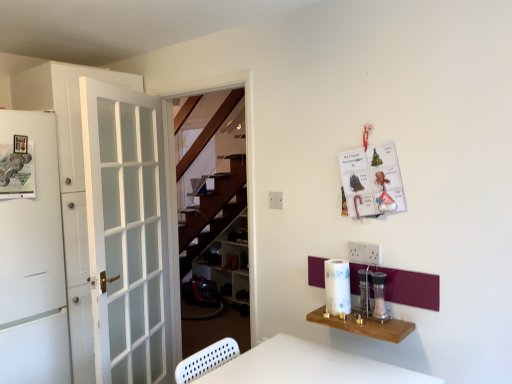
Measure the distance between white matte refrigerator at left, placed as the 1th door when sorted from front to back, and camera.

white matte refrigerator at left, placed as the 1th door when sorted from front to back, and camera are 2.12 meters apart from each other.

Consider the image. What is the approximate height of white matte refrigerator at left, the 2th door from the back?

It is 5.79 feet.

The width and height of the screenshot is (512, 384). What do you see at coordinates (379, 296) in the screenshot?
I see `clear glass salt and pepper shakers at right, the second appliance in the left-to-right sequence` at bounding box center [379, 296].

Measure the distance between metallic silver salt and pepper shakers at center right, which ranks as the 1th appliance in left-to-right order, and camera.

metallic silver salt and pepper shakers at center right, which ranks as the 1th appliance in left-to-right order, and camera are 5.98 feet apart from each other.

The image size is (512, 384). Identify the location of metallic silver salt and pepper shakers at center right, which appears as the 2th appliance when viewed from the right. (365, 291).

Locate an element on the screen. The width and height of the screenshot is (512, 384). white glass door at left, the 1th door in the back-to-front sequence is located at coordinates (60, 103).

Measure the distance between point (92, 68) and camera.

Point (92, 68) is 8.16 feet away from camera.

Locate an element on the screen. The image size is (512, 384). wooden shelf at lower right is located at coordinates (365, 326).

Where is `white matte refrigerator at left, placed as the 1th door when sorted from front to back`? white matte refrigerator at left, placed as the 1th door when sorted from front to back is located at coordinates (32, 258).

Measure the distance from white matte refrigerator at left, the 2th door from the back, to wooden shelves at center.

The distance of white matte refrigerator at left, the 2th door from the back, from wooden shelves at center is 7.85 feet.

Is white matte refrigerator at left, the 2th door from the back, not within wooden shelves at center?

Indeed, white matte refrigerator at left, the 2th door from the back, is completely outside wooden shelves at center.

From the wooden shelves at center, count 2nd doors forward and point to it. Please provide its 2D coordinates.

[(32, 258)]

Is white matte refrigerator at left, the 2th door from the back, not close to wooden shelves at center?

white matte refrigerator at left, the 2th door from the back, is far away from wooden shelves at center.

Is there a large distance between clear glass salt and pepper shakers at right, the second appliance in the left-to-right sequence, and wooden shelves at center?

Absolutely, clear glass salt and pepper shakers at right, the second appliance in the left-to-right sequence, is distant from wooden shelves at center.

Between clear glass salt and pepper shakers at right, placed as the 1th appliance when sorted from right to left, and wooden shelves at center, which one has larger width?

wooden shelves at center.

From the image's perspective, does clear glass salt and pepper shakers at right, placed as the 1th appliance when sorted from right to left, appear lower than wooden shelves at center?

Incorrect, from the image's perspective, clear glass salt and pepper shakers at right, placed as the 1th appliance when sorted from right to left, is higher than wooden shelves at center.

Considering the sizes of objects white glass door at left, the 1th door in the back-to-front sequence, and metallic silver salt and pepper shakers at center right, which ranks as the 1th appliance in left-to-right order, in the image provided, who is taller, white glass door at left, the 1th door in the back-to-front sequence, or metallic silver salt and pepper shakers at center right, which ranks as the 1th appliance in left-to-right order,?

Standing taller between the two is white glass door at left, the 1th door in the back-to-front sequence.

Considering the sizes of objects white glass door at left, positioned as the 2th door in front-to-back order, and metallic silver salt and pepper shakers at center right, which appears as the 2th appliance when viewed from the right, in the image provided, who is thinner, white glass door at left, positioned as the 2th door in front-to-back order, or metallic silver salt and pepper shakers at center right, which appears as the 2th appliance when viewed from the right,?

Thinner between the two is metallic silver salt and pepper shakers at center right, which appears as the 2th appliance when viewed from the right.

From a real-world perspective, is white glass door at left, positioned as the 2th door in front-to-back order, located beneath metallic silver salt and pepper shakers at center right, which ranks as the 1th appliance in left-to-right order?

No, from a real-world perspective, white glass door at left, positioned as the 2th door in front-to-back order, is not below metallic silver salt and pepper shakers at center right, which ranks as the 1th appliance in left-to-right order.

Is metallic silver salt and pepper shakers at center right, which appears as the 2th appliance when viewed from the right, oriented away from wooden shelves at center?

No.

Between metallic silver salt and pepper shakers at center right, which ranks as the 1th appliance in left-to-right order, and wooden shelves at center, which one has more height?

wooden shelves at center.

From a real-world perspective, is metallic silver salt and pepper shakers at center right, which appears as the 2th appliance when viewed from the right, physically located above or below wooden shelves at center?

Clearly, from a real-world perspective, metallic silver salt and pepper shakers at center right, which appears as the 2th appliance when viewed from the right, is above wooden shelves at center.

Is metallic silver salt and pepper shakers at center right, which appears as the 2th appliance when viewed from the right, wider than wooden shelves at center?

No.

Is clear glass salt and pepper shakers at right, the second appliance in the left-to-right sequence, oriented away from white matte refrigerator at left, placed as the 1th door when sorted from front to back?

clear glass salt and pepper shakers at right, the second appliance in the left-to-right sequence, does not have its back to white matte refrigerator at left, placed as the 1th door when sorted from front to back.

Is white matte refrigerator at left, placed as the 1th door when sorted from front to back, completely or partially inside clear glass salt and pepper shakers at right, the second appliance in the left-to-right sequence?

Actually, white matte refrigerator at left, placed as the 1th door when sorted from front to back, is outside clear glass salt and pepper shakers at right, the second appliance in the left-to-right sequence.

Which is in front, clear glass salt and pepper shakers at right, placed as the 1th appliance when sorted from right to left, or white matte refrigerator at left, placed as the 1th door when sorted from front to back?

clear glass salt and pepper shakers at right, placed as the 1th appliance when sorted from right to left, is closer to the camera.

From the image's perspective, which is below, wooden shelves at center or metallic silver salt and pepper shakers at center right, which appears as the 2th appliance when viewed from the right?

wooden shelves at center, from the image's perspective.

Is wooden shelves at center touching metallic silver salt and pepper shakers at center right, which appears as the 2th appliance when viewed from the right?

No, wooden shelves at center is not touching metallic silver salt and pepper shakers at center right, which appears as the 2th appliance when viewed from the right.

In the scene shown: Between wooden shelves at center and metallic silver salt and pepper shakers at center right, which appears as the 2th appliance when viewed from the right, which one has smaller size?

Smaller between the two is metallic silver salt and pepper shakers at center right, which appears as the 2th appliance when viewed from the right.

Is metallic silver salt and pepper shakers at center right, which appears as the 2th appliance when viewed from the right, looking in the opposite direction of clear glass salt and pepper shakers at right, the second appliance in the left-to-right sequence?

That's not correct — metallic silver salt and pepper shakers at center right, which appears as the 2th appliance when viewed from the right, is not looking away from clear glass salt and pepper shakers at right, the second appliance in the left-to-right sequence.

The image size is (512, 384). I want to click on appliance above the clear glass salt and pepper shakers at right, placed as the 1th appliance when sorted from right to left (from a real-world perspective), so click(365, 291).

Considering the relative sizes of metallic silver salt and pepper shakers at center right, which appears as the 2th appliance when viewed from the right, and clear glass salt and pepper shakers at right, the second appliance in the left-to-right sequence, in the image provided, is metallic silver salt and pepper shakers at center right, which appears as the 2th appliance when viewed from the right, thinner than clear glass salt and pepper shakers at right, the second appliance in the left-to-right sequence,?

Incorrect, the width of metallic silver salt and pepper shakers at center right, which appears as the 2th appliance when viewed from the right, is not less than that of clear glass salt and pepper shakers at right, the second appliance in the left-to-right sequence.

You are a GUI agent. You are given a task and a screenshot of the screen. Output one action in this format:
    pyautogui.click(x=<x>, y=<y>)
    Task: Click on the door that is the 1st object located above the wooden shelves at center (from the image's perspective)
    The image size is (512, 384).
    Given the screenshot: What is the action you would take?
    pyautogui.click(x=32, y=258)

You are a GUI agent. You are given a task and a screenshot of the screen. Output one action in this format:
    pyautogui.click(x=<x>, y=<y>)
    Task: Click on the 2nd appliance counting from the right side of the wooden shelves at center
    
    Given the screenshot: What is the action you would take?
    pyautogui.click(x=379, y=296)

Based on their spatial positions, is wooden shelf at lower right or clear glass salt and pepper shakers at right, the second appliance in the left-to-right sequence, further from metallic silver salt and pepper shakers at center right, which appears as the 2th appliance when viewed from the right?

wooden shelf at lower right is further to metallic silver salt and pepper shakers at center right, which appears as the 2th appliance when viewed from the right.

Based on their spatial positions, is white glass door at left, positioned as the 2th door in front-to-back order, or metallic silver salt and pepper shakers at center right, which appears as the 2th appliance when viewed from the right, closer to white matte refrigerator at left, placed as the 1th door when sorted from front to back?

Based on the image, white glass door at left, positioned as the 2th door in front-to-back order, appears to be nearer to white matte refrigerator at left, placed as the 1th door when sorted from front to back.

From the image, which object appears to be farther from wooden shelf at lower right, white matte refrigerator at left, placed as the 1th door when sorted from front to back, or clear glass salt and pepper shakers at right, placed as the 1th appliance when sorted from right to left?

white matte refrigerator at left, placed as the 1th door when sorted from front to back, lies further to wooden shelf at lower right than the other object.

From the picture: Which object lies nearer to the anchor point metallic silver salt and pepper shakers at center right, which ranks as the 1th appliance in left-to-right order, white matte refrigerator at left, placed as the 1th door when sorted from front to back, or wooden shelf at lower right?

Based on the image, wooden shelf at lower right appears to be nearer to metallic silver salt and pepper shakers at center right, which ranks as the 1th appliance in left-to-right order.

When comparing their distances from white glass door at left, positioned as the 2th door in front-to-back order, does white matte refrigerator at left, placed as the 1th door when sorted from front to back, or wooden shelves at center seem closer?

white matte refrigerator at left, placed as the 1th door when sorted from front to back.

When comparing their distances from wooden shelf at lower right, does white glass door at left, positioned as the 2th door in front-to-back order, or metallic silver salt and pepper shakers at center right, which appears as the 2th appliance when viewed from the right, seem further?

Based on the image, white glass door at left, positioned as the 2th door in front-to-back order, appears to be further to wooden shelf at lower right.

Based on the photo, when comparing their distances from metallic silver salt and pepper shakers at center right, which appears as the 2th appliance when viewed from the right, does white matte refrigerator at left, placed as the 1th door when sorted from front to back, or wooden shelves at center seem further?

Based on the image, wooden shelves at center appears to be further to metallic silver salt and pepper shakers at center right, which appears as the 2th appliance when viewed from the right.

Looking at the image, which one is located further to white matte refrigerator at left, the 2th door from the back, metallic silver salt and pepper shakers at center right, which ranks as the 1th appliance in left-to-right order, or wooden shelves at center?

wooden shelves at center is positioned further to the anchor white matte refrigerator at left, the 2th door from the back.

Where is `door between white matte refrigerator at left, the 2th door from the back, and wooden shelves at center from front to back`? The width and height of the screenshot is (512, 384). door between white matte refrigerator at left, the 2th door from the back, and wooden shelves at center from front to back is located at coordinates (60, 103).

I want to click on table between white matte refrigerator at left, the 2th door from the back, and metallic silver salt and pepper shakers at center right, which appears as the 2th appliance when viewed from the right, from left to right, so click(x=365, y=326).

Locate an element on the screen. appliance between wooden shelf at lower right and metallic silver salt and pepper shakers at center right, which ranks as the 1th appliance in left-to-right order, along the z-axis is located at coordinates (379, 296).

Where is `table between white glass door at left, the 1th door in the back-to-front sequence, and clear glass salt and pepper shakers at right, the second appliance in the left-to-right sequence`? This screenshot has width=512, height=384. table between white glass door at left, the 1th door in the back-to-front sequence, and clear glass salt and pepper shakers at right, the second appliance in the left-to-right sequence is located at coordinates (365, 326).